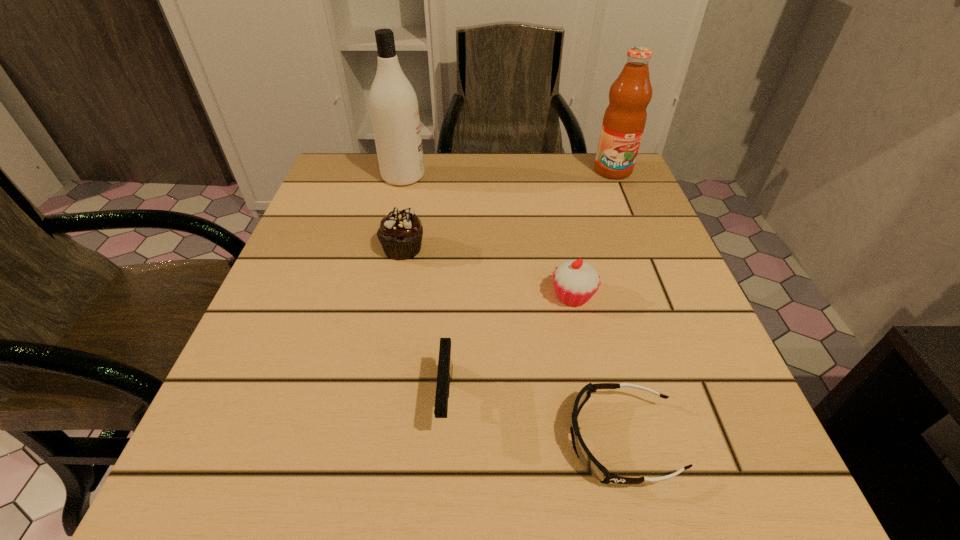
You are a GUI agent. You are given a task and a screenshot of the screen. Output one action in this format:
    pyautogui.click(x=<x>, y=<y>)
    Task: Click on the vacant space positioned on the front label of the fruit juice
    The width and height of the screenshot is (960, 540).
    Given the screenshot: What is the action you would take?
    pyautogui.click(x=638, y=233)

You are a GUI agent. You are given a task and a screenshot of the screen. Output one action in this format:
    pyautogui.click(x=<x>, y=<y>)
    Task: Click on the free location located on the left of the left cupcake
    This screenshot has width=960, height=540.
    Given the screenshot: What is the action you would take?
    pyautogui.click(x=346, y=249)

Locate an element on the screen. Image resolution: width=960 pixels, height=540 pixels. free location located on the left of the fourth farthest object is located at coordinates (374, 296).

The image size is (960, 540). I want to click on vacant region located on the front-facing side of the fourth object from right to left, so click(440, 507).

What are the coordinates of `vacant area situated 0.240m on the front and sides of the shortest object` in the screenshot? It's located at (388, 440).

I want to click on free spot located 0.390m on the front and sides of the shortest object, so click(x=276, y=440).

Find the location of `vacant space located 0.260m on the front and sides of the shortest object`. vacant space located 0.260m on the front and sides of the shortest object is located at coordinates (373, 440).

This screenshot has width=960, height=540. Find the location of `shampoo that is at the far edge`. shampoo that is at the far edge is located at coordinates (393, 103).

Find the location of a particular element. fruit juice present at the far edge is located at coordinates (624, 120).

At what (x,y) coordinates should I click in order to perform the action: click on object that is at the near edge. Please return your answer as a coordinate pair (x, y). The height and width of the screenshot is (540, 960). Looking at the image, I should click on (594, 467).